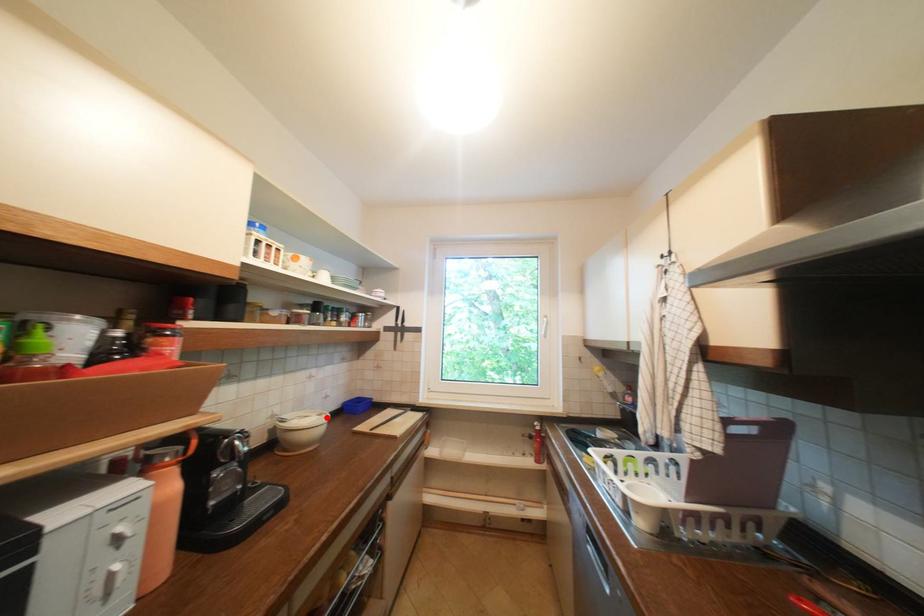
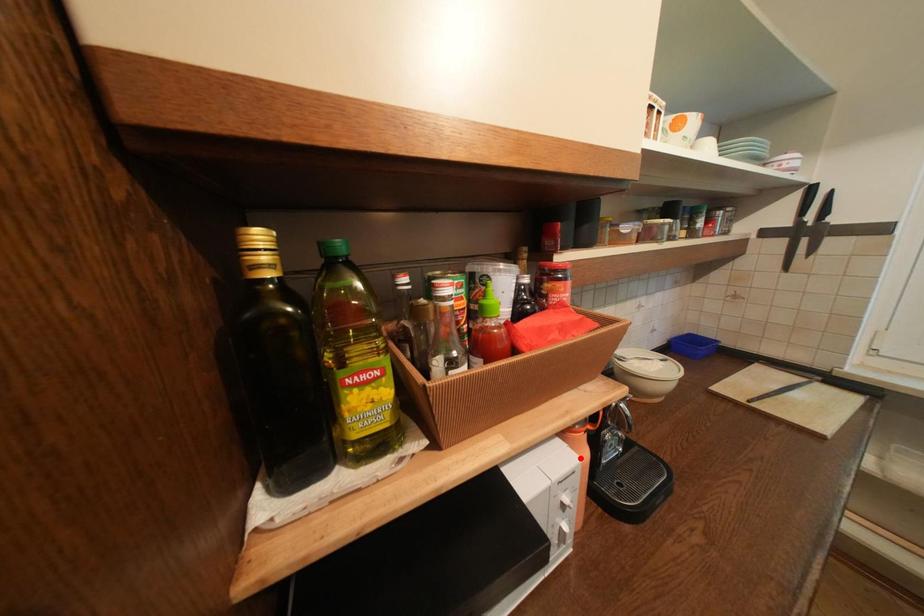
In the scene shown: I am providing you with two images of the same scene from different viewpoints. A red point is marked on the first image and another point is marked on the second image. Is the red point in image1 aligned with the point shown in image2?

No